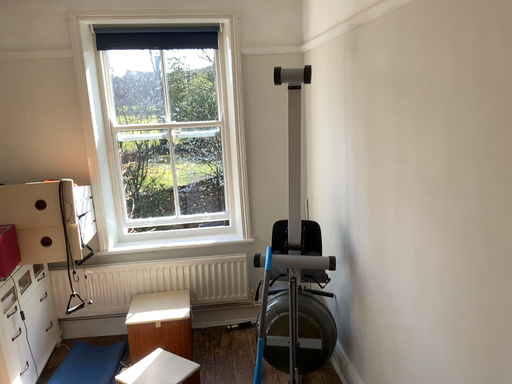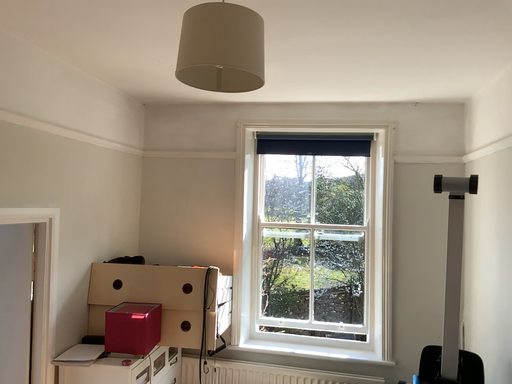
Question: Which way did the camera rotate in the video?

Choices:
 (A) rotated right
 (B) rotated left

Answer: (B)